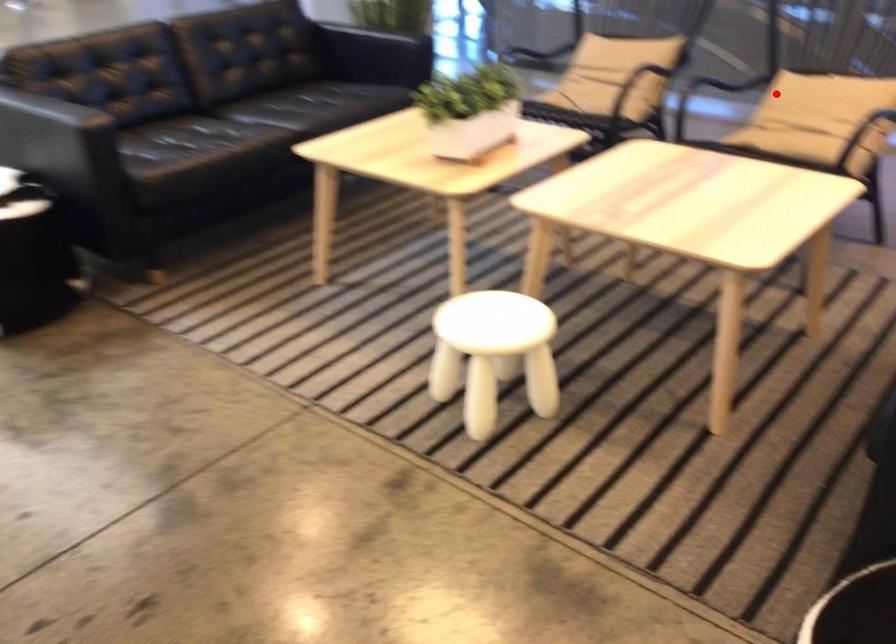
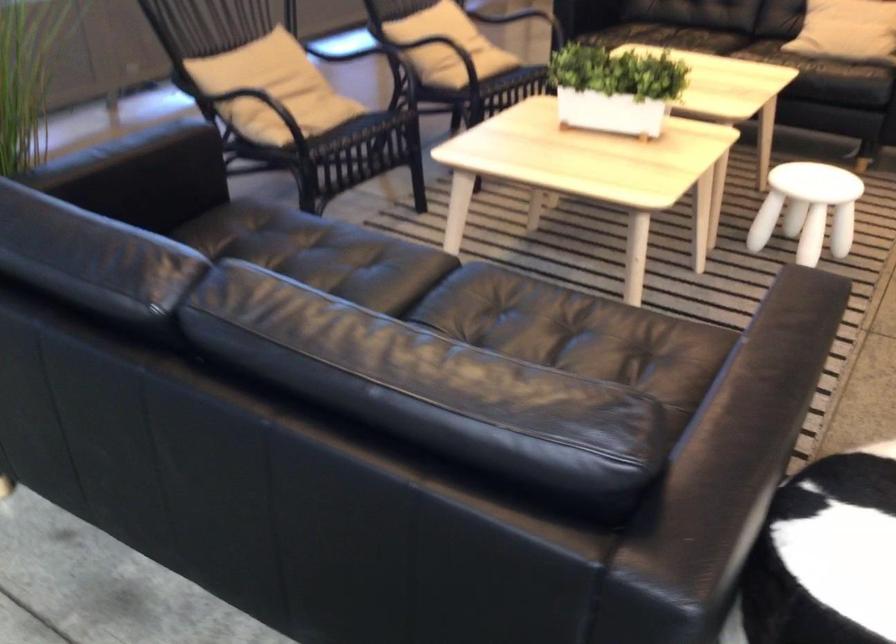
The point at the highlighted location is marked in the first image. Where is the corresponding point in the second image?

(433, 43)